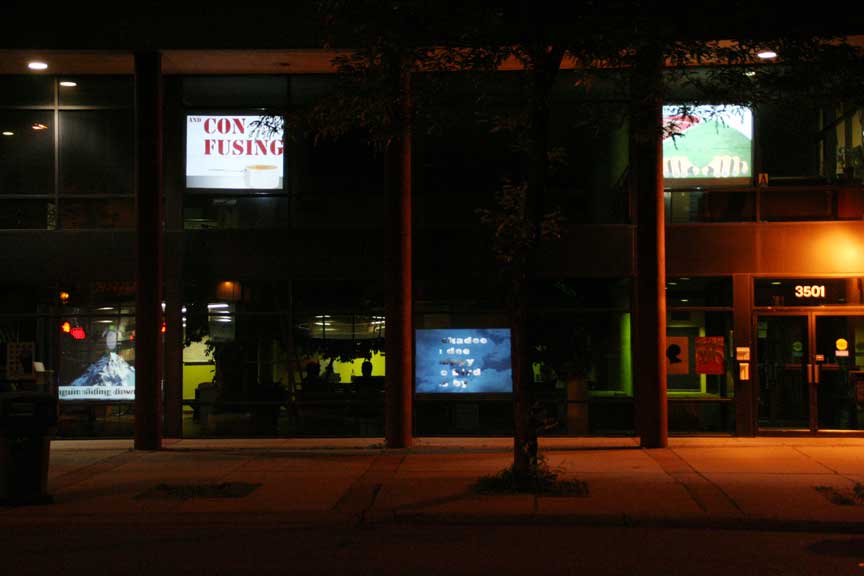
The height and width of the screenshot is (576, 864). I want to click on door handles, so click(812, 375).